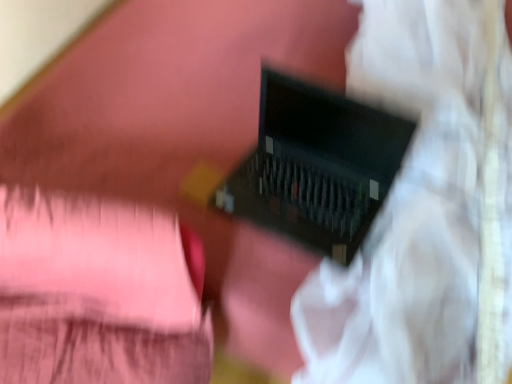
Question: From a real-world perspective, is black plastic computer at center physically located above or below matte black laptop at center?

Choices:
 (A) below
 (B) above

Answer: (B)

Question: In the image, is black plastic computer at center positioned in front of or behind matte black laptop at center?

Choices:
 (A) front
 (B) behind

Answer: (B)

Question: Looking at their shapes, would you say black plastic computer at center is wider or thinner than matte black laptop at center?

Choices:
 (A) thin
 (B) wide

Answer: (A)

Question: In terms of size, does matte black laptop at center appear bigger or smaller than black plastic computer at center?

Choices:
 (A) big
 (B) small

Answer: (A)

Question: In terms of height, does matte black laptop at center look taller or shorter compared to black plastic computer at center?

Choices:
 (A) short
 (B) tall

Answer: (B)

Question: From a real-world perspective, is matte black laptop at center physically located above or below black plastic computer at center?

Choices:
 (A) below
 (B) above

Answer: (A)

Question: Is matte black laptop at center spatially inside black plastic computer at center, or outside of it?

Choices:
 (A) outside
 (B) inside

Answer: (A)